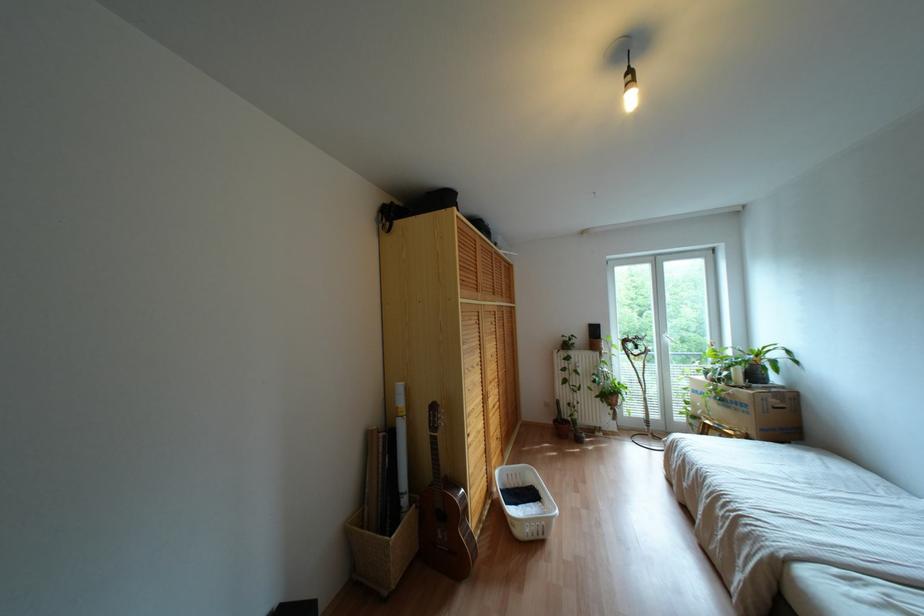
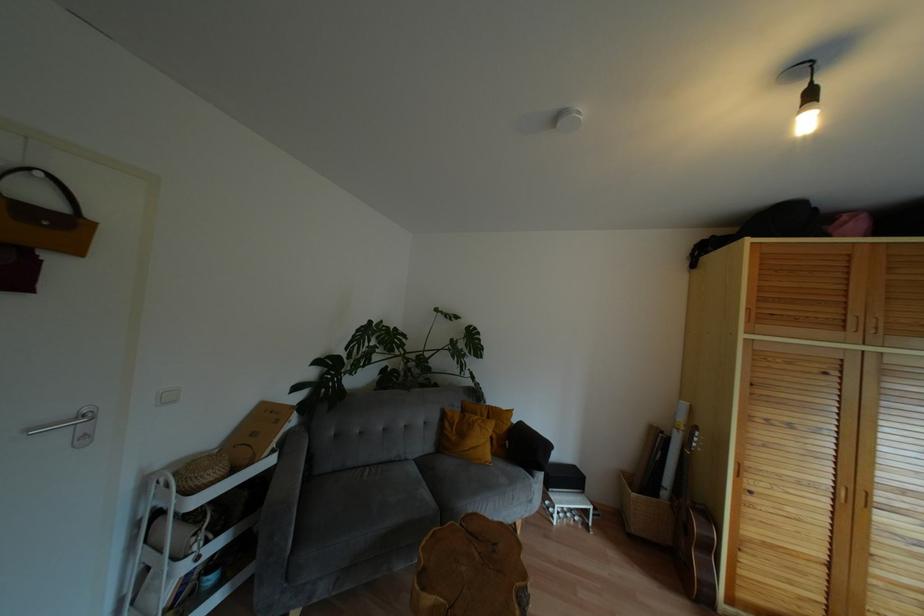
In the second image, find the point that corresponds to (x=630, y=100) in the first image.

(806, 123)